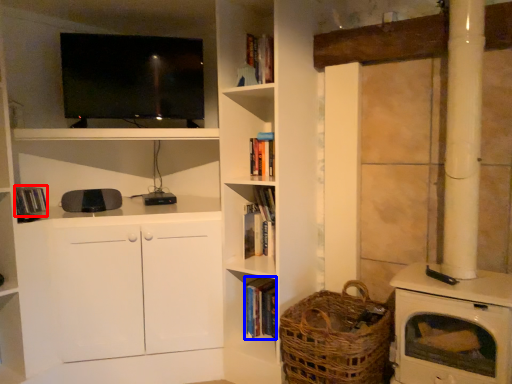
Question: Which of the following is the farthest to the observer, book (highlighted by a red box) or book (highlighted by a blue box)?

Choices:
 (A) book
 (B) book

Answer: (B)